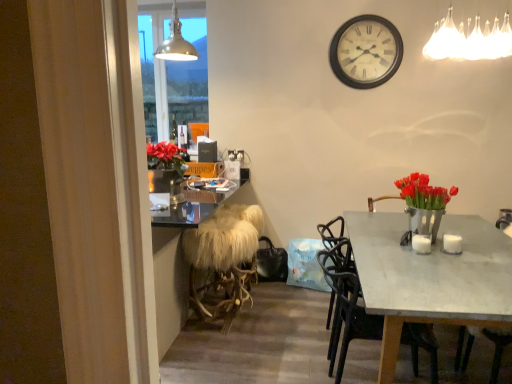
Question: Is matte gray table at center inside the boundaries of white wooden clock at upper center, or outside?

Choices:
 (A) outside
 (B) inside

Answer: (A)

Question: From the image's perspective, is matte gray table at center positioned above or below white wooden clock at upper center?

Choices:
 (A) above
 (B) below

Answer: (B)

Question: Based on their relative distances, which object is farther from the white furry stool at center?

Choices:
 (A) matte black chair at center
 (B) matte gray table at center
 (C) white wooden clock at upper center
 (D) white glossy coffee cup at table right, which is the 1th coffee cup in right-to-left order
 (E) white glossy coffee cup at right, the 1th coffee cup in the left-to-right sequence

Answer: (C)

Question: Which is farther from the matte gray table at center?

Choices:
 (A) white furry stool at center
 (B) white fabric chandelier at upper right, acting as the first lamp starting from the right
 (C) metallic pendant light at upper center, the first lamp viewed from the back
 (D) white glossy coffee cup at right, the 1th coffee cup in the left-to-right sequence
 (E) black leather speaker at upper center

Answer: (E)